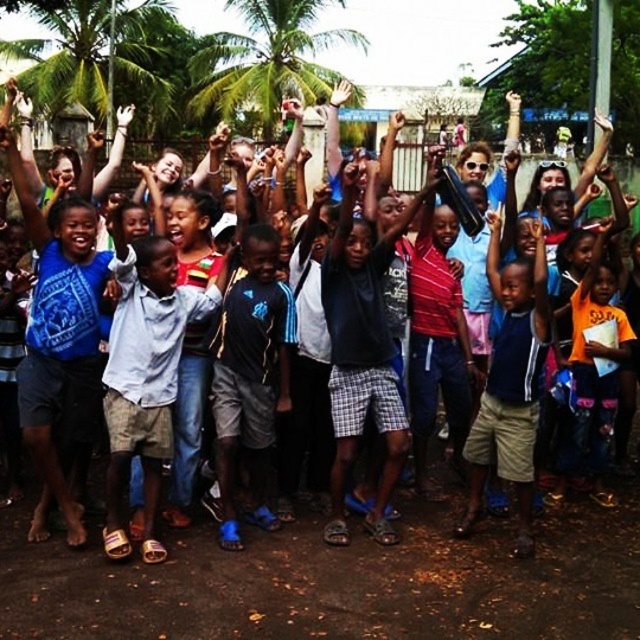
Question: Can you confirm if dark blue tank top at center is positioned to the left of green leafy palm tree at upper left?

Choices:
 (A) yes
 (B) no

Answer: (B)

Question: Estimate the real-world distances between objects in this image. Which object is closer to the light blue fabric shirt at center?

Choices:
 (A) green leafy palm tree at upper left
 (B) green leafy palm tree at upper center
 (C) dark blue tank top at center
 (D) dark blue adidas shorts at center

Answer: (D)

Question: From the image, what is the correct spatial relationship of green leafy palm tree at upper left in relation to green leafy palm tree at upper center?

Choices:
 (A) right
 (B) left

Answer: (B)

Question: Which point is closer to the camera?

Choices:
 (A) (508, 433)
 (B) (248, 292)

Answer: (A)

Question: Can you confirm if light blue fabric shirt at center is positioned below dark blue adidas shorts at center?

Choices:
 (A) no
 (B) yes

Answer: (B)

Question: Considering the real-world distances, which object is closest to the green leafy palm tree at upper left?

Choices:
 (A) dark blue tank top at center
 (B) dark blue adidas shorts at center
 (C) green leafy palm tree at upper center
 (D) light blue fabric shirt at center

Answer: (C)